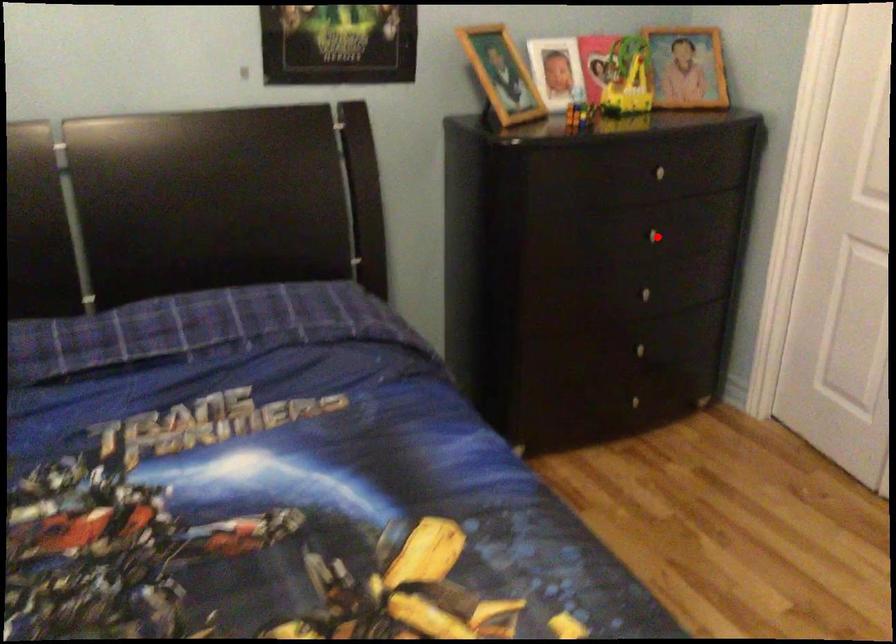
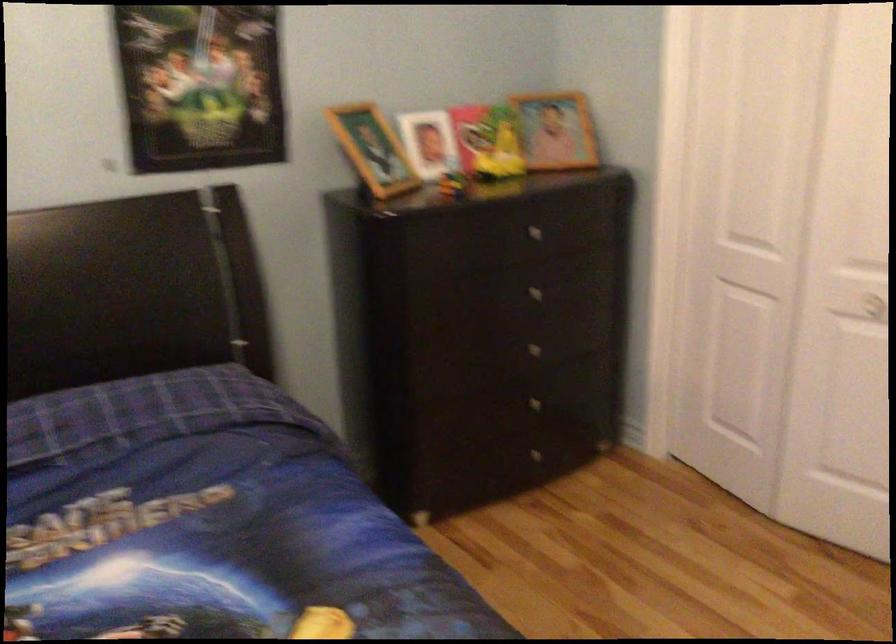
Find the pixel in the second image that matches the highlighted location in the first image.

(538, 292)